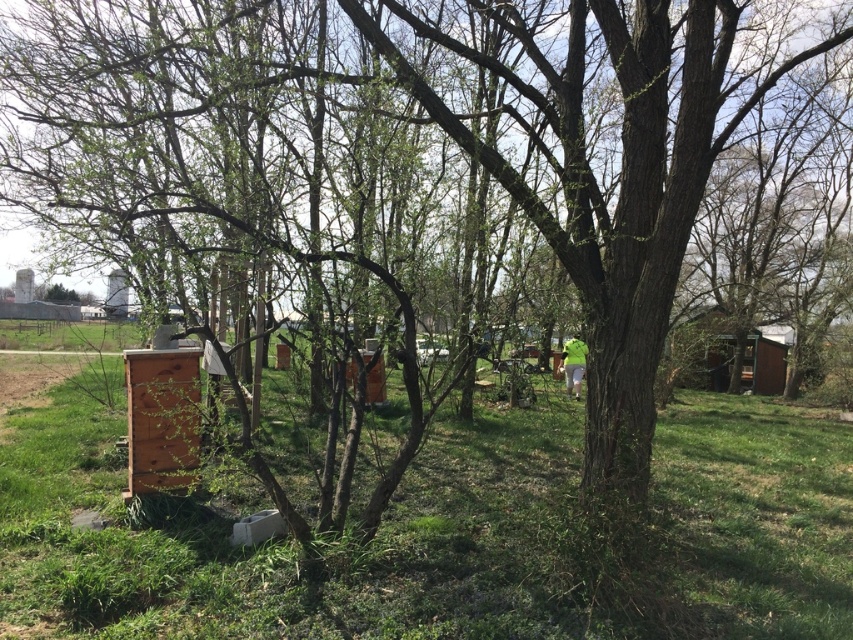
You are planning to set up a small garden in the area shown in the image. You have two options for locations based on the objects present. The first option is near the green grass at lower left, and the second is near the wooden hut at right. Considering the available space, which location would provide more room for your garden?

The wooden hut at right has more space available compared to the green grass at lower left, so the location near the wooden hut at right would provide more room for your garden.

You are standing in the outdoor scene and want to find a place to sit. You see the green grass at lower left and the wooden hut at right. Which location is lower in elevation?

The green grass at lower left is located below the wooden hut at right, so it is lower in elevation.